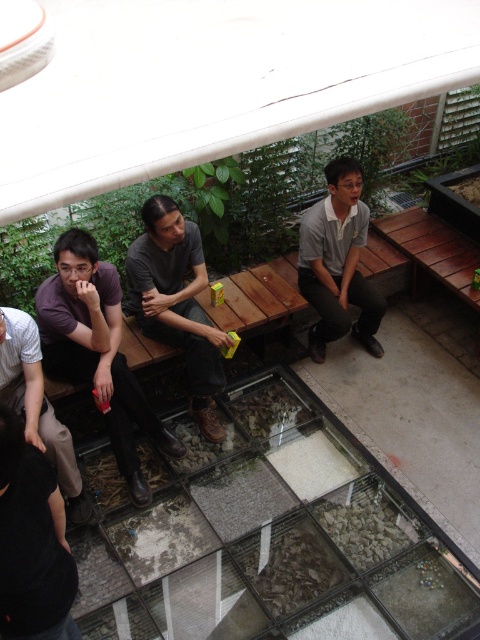
Question: Among these points, which one is farthest from the camera?

Choices:
 (A) (383, 308)
 (B) (152, 337)

Answer: (A)

Question: Can you confirm if gray matte shirt at center is positioned to the left of white striped shirt at lower left?

Choices:
 (A) yes
 (B) no

Answer: (B)

Question: Which object is positioned closest to the purple matte shirt at left?

Choices:
 (A) matte gray shirt at center
 (B) white striped shirt at lower left

Answer: (B)

Question: Which of the following is the farthest from the observer?

Choices:
 (A) (172, 268)
 (B) (328, 328)

Answer: (B)

Question: Does purple matte shirt at left have a larger size compared to matte gray shirt at center?

Choices:
 (A) no
 (B) yes

Answer: (B)

Question: In this image, where is purple matte shirt at left located relative to white striped shirt at lower left?

Choices:
 (A) above
 (B) below

Answer: (A)